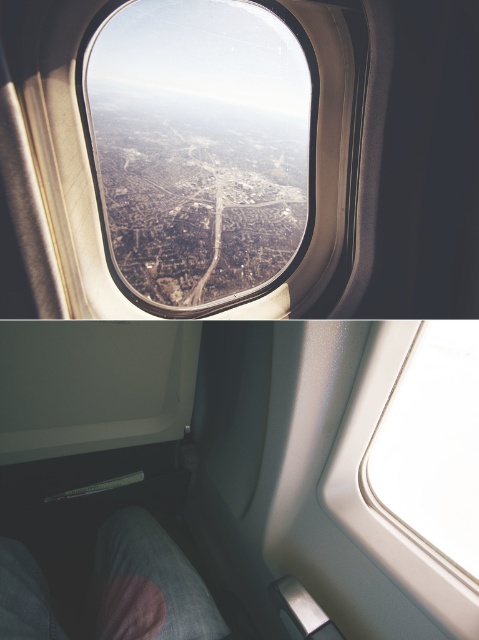
You are a passenger sitting in an airplane seat. You want to look out the transparent glass airplane window at center. Where should you look?

You should look at point (200, 147) to see the transparent glass airplane window at center.

You are a passenger sitting in an airplane seat and want to know which window you can see more of the landscape through. Which window, the transparent glass airplane window at center or the white glossy window at upper center, has a wider field of view?

The transparent glass airplane window at center has a wider field of view because its width is larger than the white glossy window at upper center.

You are sitting in an airplane seat and want to look outside. You notice the transparent glass airplane window at center and the white glossy window at upper center. Which window is closer to you?

The transparent glass airplane window at center is closer to you because the white glossy window at upper center is behind it.